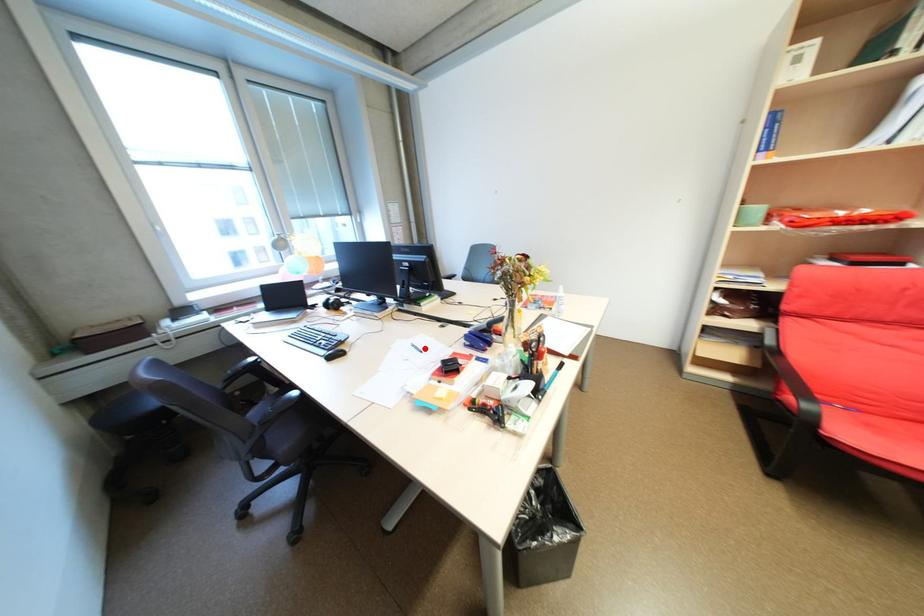
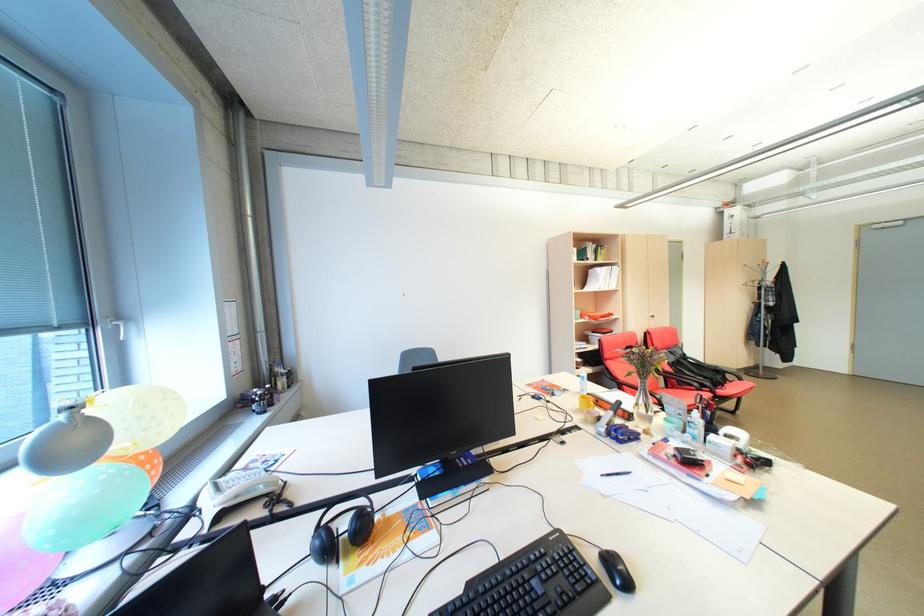
Where in the second image is the point corresponding to the highlighted location from the first image?

(627, 475)